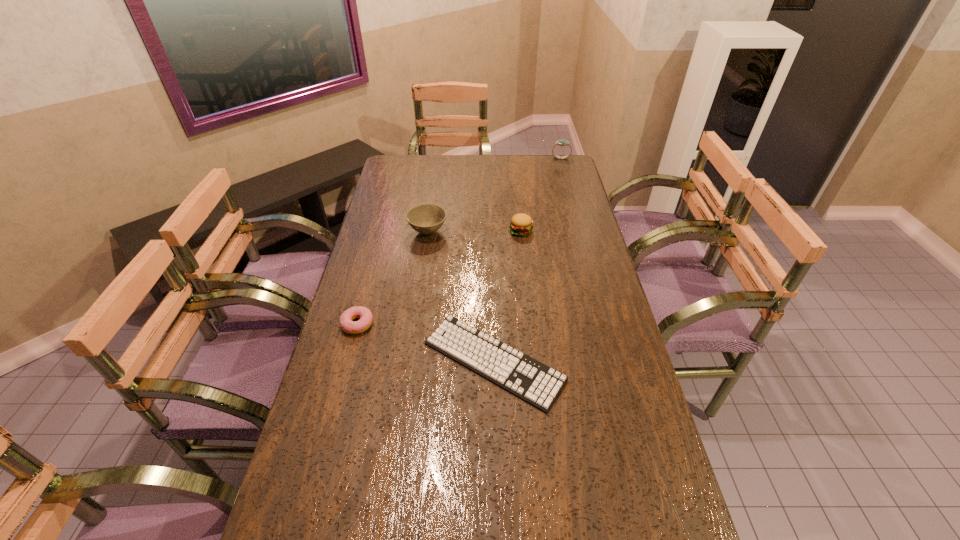
Locate an element on the screen. The width and height of the screenshot is (960, 540). free space at the far left corner is located at coordinates (393, 157).

This screenshot has width=960, height=540. In the image, there is a desktop. What are the coordinates of `vacant space at the far right corner` in the screenshot? It's located at (538, 170).

Image resolution: width=960 pixels, height=540 pixels. Identify the location of vacant area that lies between the watch and the hamburger. (540, 194).

Image resolution: width=960 pixels, height=540 pixels. Identify the location of vacant region between the shortest object and the bowl. (461, 296).

Locate an element on the screen. The height and width of the screenshot is (540, 960). vacant space that is in between the rightmost object and the second shortest object is located at coordinates (459, 241).

Image resolution: width=960 pixels, height=540 pixels. Identify the location of empty space that is in between the third shortest object and the bowl. (474, 231).

This screenshot has height=540, width=960. What are the coordinates of `empty space that is in between the computer keyboard and the watch` in the screenshot? It's located at (527, 260).

Where is `free space that is in between the farthest object and the bowl`? This screenshot has height=540, width=960. free space that is in between the farthest object and the bowl is located at coordinates (494, 195).

Image resolution: width=960 pixels, height=540 pixels. In order to click on free space between the farthest object and the computer keyboard in this screenshot , I will do `click(527, 260)`.

Find the location of a particular element. free space between the second shortest object and the farthest object is located at coordinates (459, 241).